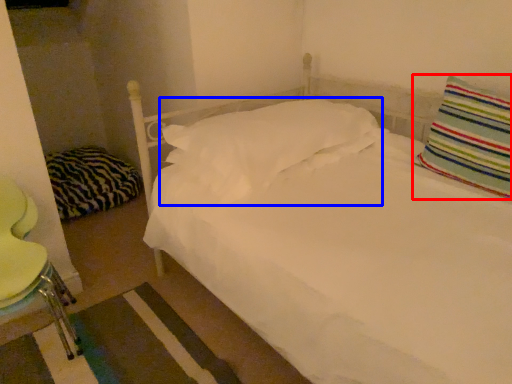
Question: Among these objects, which one is nearest to the camera, pillow (highlighted by a red box) or pillow (highlighted by a blue box)?

Choices:
 (A) pillow
 (B) pillow

Answer: (A)